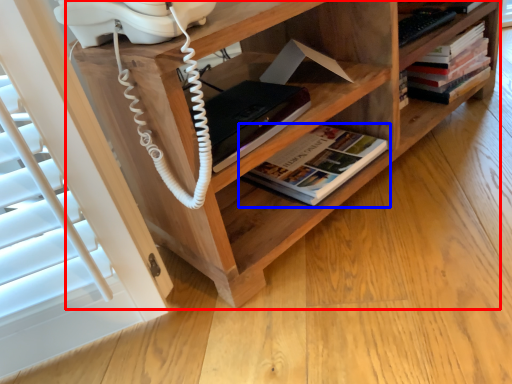
Question: Among these objects, which one is nearest to the camera, shelf (highlighted by a red box) or book (highlighted by a blue box)?

Choices:
 (A) shelf
 (B) book

Answer: (A)